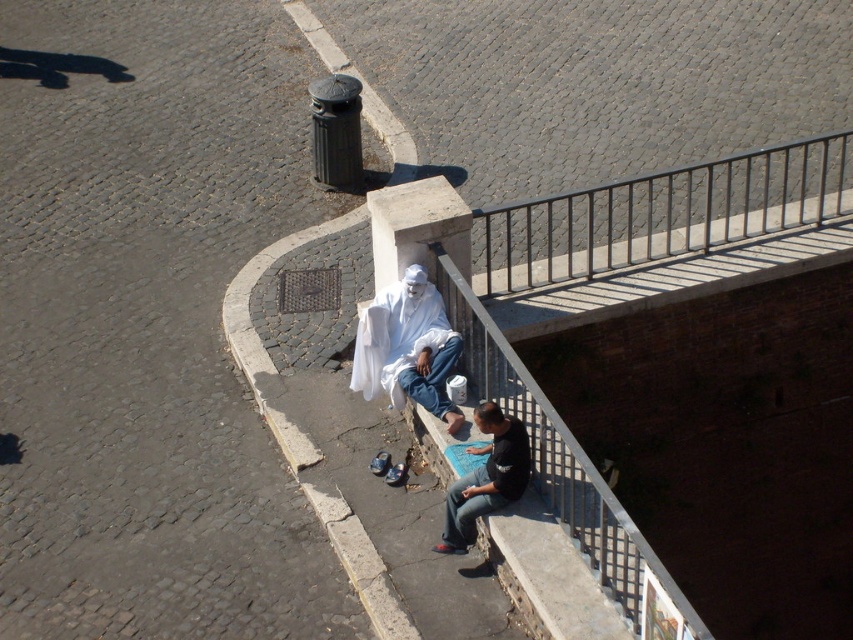
You are a photographer planning to take a picture of the white cloth at center and the black cotton shirt at lower center. Which object should you focus on first if you want to capture both in sharp focus, considering their sizes?

The white cloth at center is larger in size than the black cotton shirt at lower center, so you should focus on the white cloth at center first to ensure both are in sharp focus.

You are standing on the ledge and want to place a small bag on the metallic silver rail at upper right. According to the scene description, where exactly should you place it?

The metallic silver rail at upper right should be placed at coordinates point (660, 214).

You are a photographer trying to capture both the metallic silver rail at upper right and the black cotton shirt at lower center in the same frame. Based on their sizes, which object should you focus on first to ensure both are clearly visible in your photo?

The metallic silver rail at upper right has a larger size compared to the black cotton shirt at lower center, so you should focus on the metallic silver rail at upper right first to ensure both objects are clearly visible in the photo.